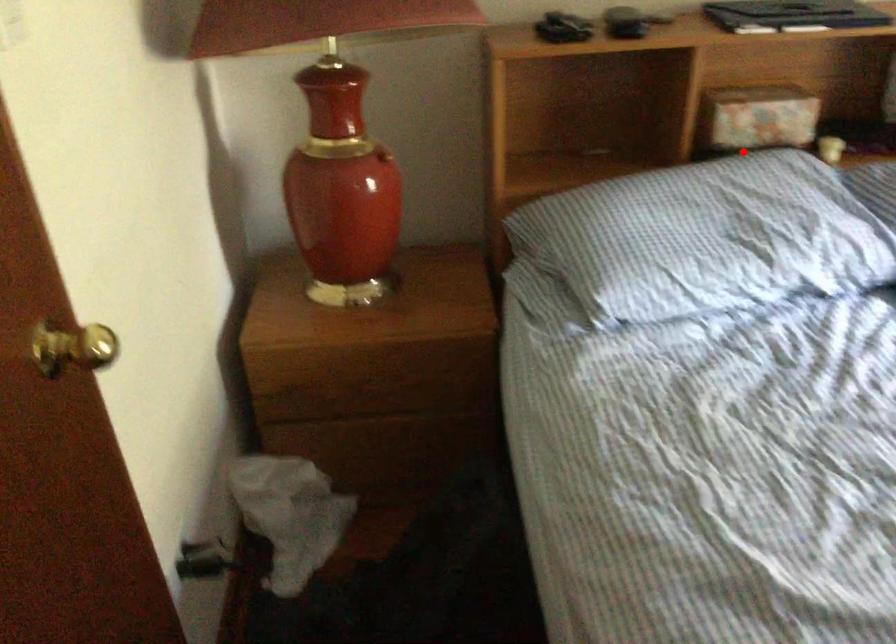
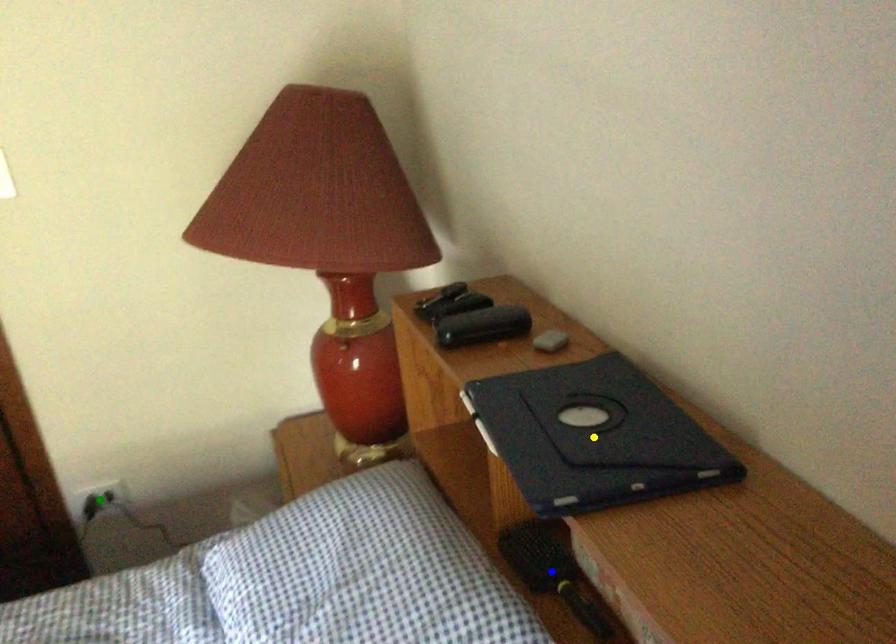
Question: I am providing you with two images of the same scene from different viewpoints. A red point is marked on the first image. You are given multiple points on the second image. Which mark in image 2 goes with the point in image 1?

Choices:
 (A) green point
 (B) yellow point
 (C) blue point

Answer: (C)